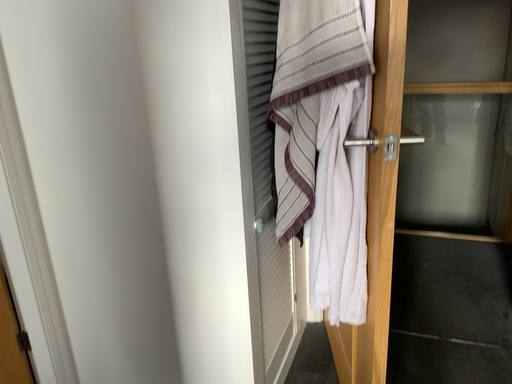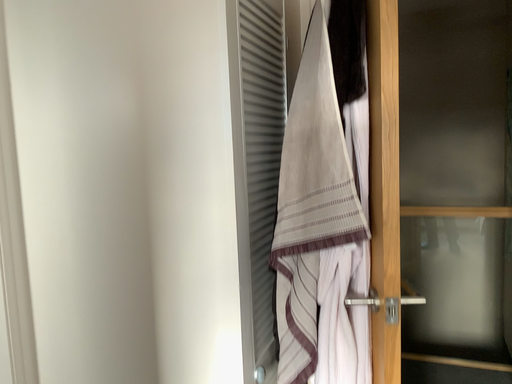
Question: How did the camera likely rotate when shooting the video?

Choices:
 (A) rotated upward
 (B) rotated downward

Answer: (A)